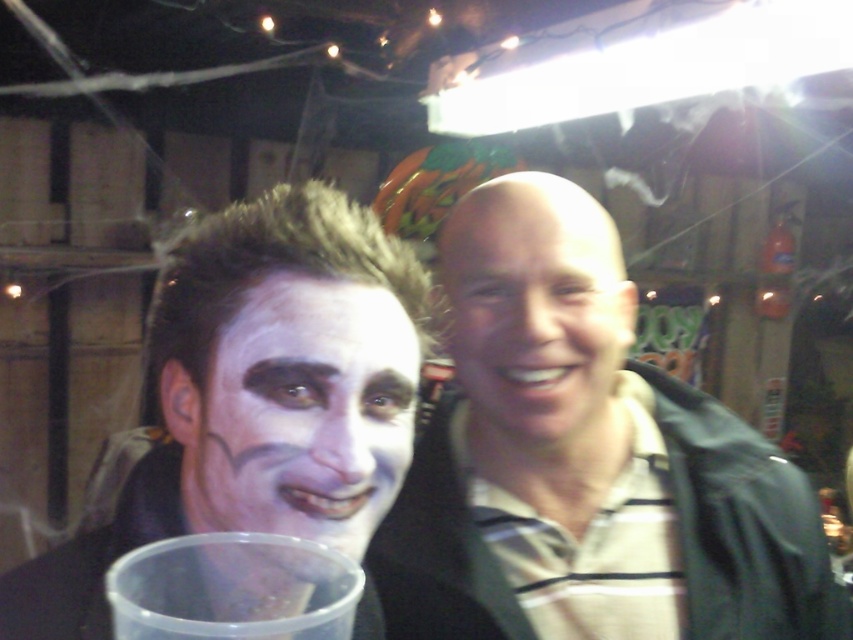
You are a photographer at a Halloween party. You need to adjust the lighting to ensure both the white matte face paint at center and the clear plastic cup at lower left are visible. Considering their sizes, which object might require more focused lighting to stand out?

The white matte face paint at center has a larger size compared to the clear plastic cup at lower left, so it might require more focused lighting to stand out due to its bigger presence in the frame.

You are a photographer at this Halloween event. You need to adjust the lighting to ensure both the matte black jacket at center and the white matte face paint at center are well illuminated. Considering their sizes, which object might require more focused lighting to stand out?

The white matte face paint at center is smaller than the matte black jacket at center. Since the face paint is smaller, it might need more focused lighting to ensure it stands out against the darker background and the larger jacket.

You are a photographer at a Halloween party. You notice the white matte face paint at center and the clear plastic cup at lower left in the frame. Can you tell if there is enough space between them to fit a 10 cm long decorative ribbon without overlapping?

The white matte face paint at center and clear plastic cup at lower left are 8.81 centimeters apart from each other. Since the decorative ribbon is 10 cm long, it cannot fit between them without overlapping.